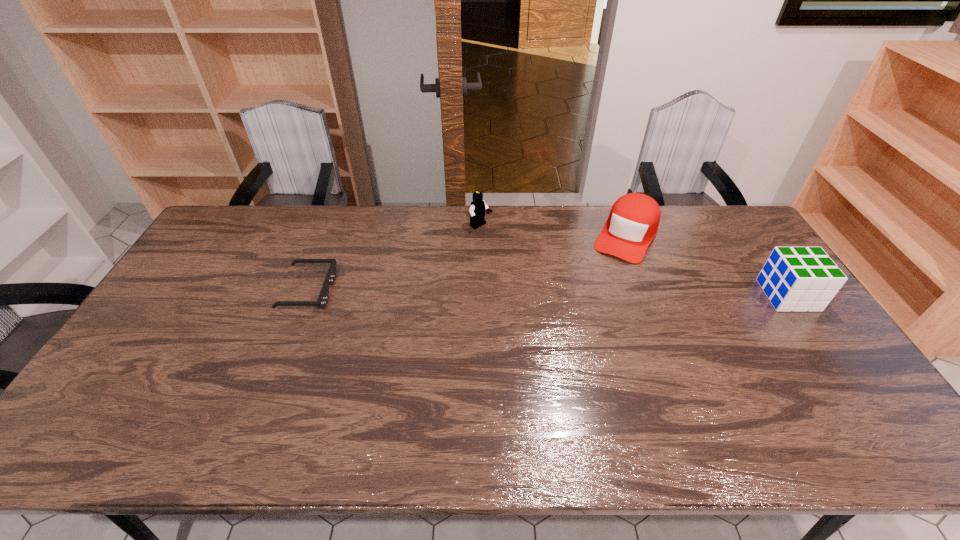
You are a GUI agent. You are given a task and a screenshot of the screen. Output one action in this format:
    pyautogui.click(x=<x>, y=<y>)
    Task: Click on the leftmost object
    The width and height of the screenshot is (960, 540).
    Given the screenshot: What is the action you would take?
    pyautogui.click(x=322, y=301)

Where is `sunglasses`? sunglasses is located at coordinates (322, 301).

Locate an element on the screen. The width and height of the screenshot is (960, 540). the rightmost object is located at coordinates (799, 279).

You are a GUI agent. You are given a task and a screenshot of the screen. Output one action in this format:
    pyautogui.click(x=<x>, y=<y>)
    Task: Click on the baseball cap
    
    Given the screenshot: What is the action you would take?
    pyautogui.click(x=634, y=218)

Locate an element on the screen. Image resolution: width=960 pixels, height=540 pixels. Lego is located at coordinates (478, 206).

The height and width of the screenshot is (540, 960). Identify the location of vacant space positioned 0.400m on the front-facing side of the shortest object. (461, 291).

Locate an element on the screen. Image resolution: width=960 pixels, height=540 pixels. vacant space located 0.140m on the front-facing side of the baseball cap is located at coordinates (601, 286).

At what (x,y) coordinates should I click in order to perform the action: click on vacant region located 0.390m on the front-facing side of the baseball cap. Please return your answer as a coordinate pair (x, y). The image size is (960, 540). Looking at the image, I should click on (570, 340).

This screenshot has height=540, width=960. Find the location of `free location located on the front-facing side of the baseball cap`. free location located on the front-facing side of the baseball cap is located at coordinates (584, 316).

Where is `free location located on the front-facing side of the third object from right to left`? free location located on the front-facing side of the third object from right to left is located at coordinates (521, 253).